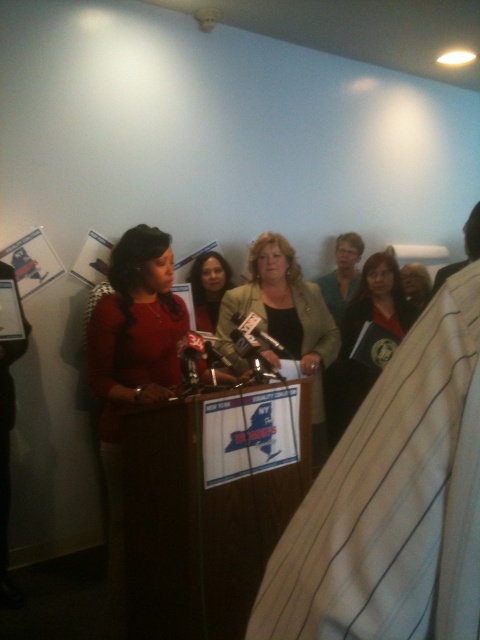
You are a photographer at the press conference and need to capture a closeup of the teal fabric shirt at center without the matte black folder at center overlapping. Given the current setup, is this possible?

The matte black folder at center is wider than the teal fabric shirt at center, so it may block part of the shirt. Adjust the camera angle or move closer to avoid the folder overlapping the shirt.

You are a photographer at the press conference. You need to capture a clear photo of both the matte green blazer at center and the matte black folder at center. Which object should you focus on first to ensure both are in frame without moving the camera?

The matte green blazer at center has a larger size compared to the matte black folder at center, so focusing on the larger matte green blazer at center first will ensure both objects are in frame without needing to adjust the camera position.